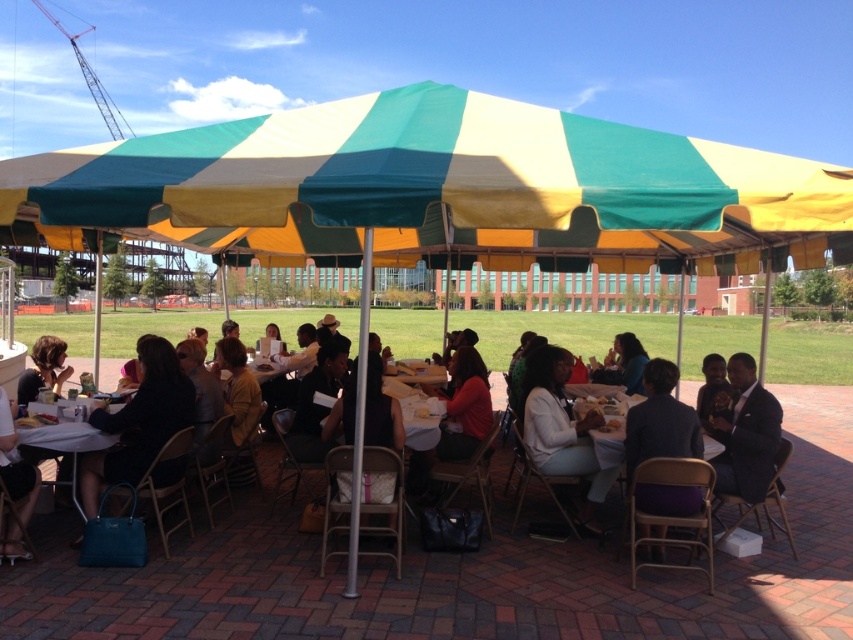
You are standing at the center of the brick area and want to place a new table at the point marked by point (65, 436). Is that location suitable for placing a table?

The point (65, 436) indicates a white plastic table at lower left, so placing another table there would not be suitable as the location is already occupied by the white plastic table at lower left.

You are at a social event under the striped canopy tent. You notice a matte black handbag at lower left and a black matte shirt at center. Which object is positioned more to the left side of the scene?

The matte black handbag at lower left is positioned more to the left side of the scene than the black matte shirt at center.

You are organizing a picnic and need to decide where to place your items. You have a matte black handbag at lower left and a black matte shirt at center. Which item has more space available for storing items?

The matte black handbag at lower left is larger in size than the black matte shirt at center, so it has more space available for storing items.